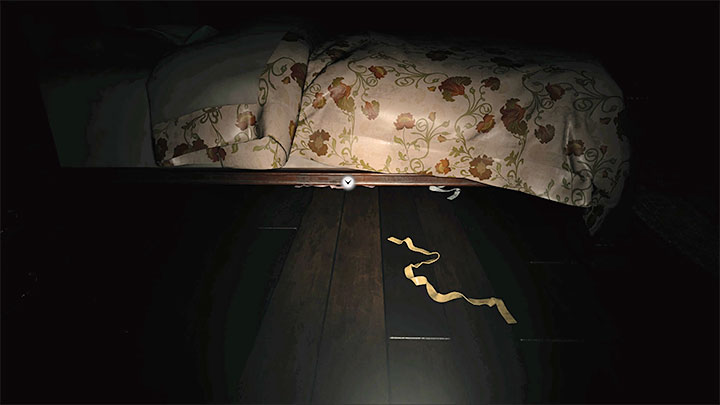
Identify the location of bright light areas. The width and height of the screenshot is (720, 405). (210, 102), (256, 270), (467, 274), (384, 101).